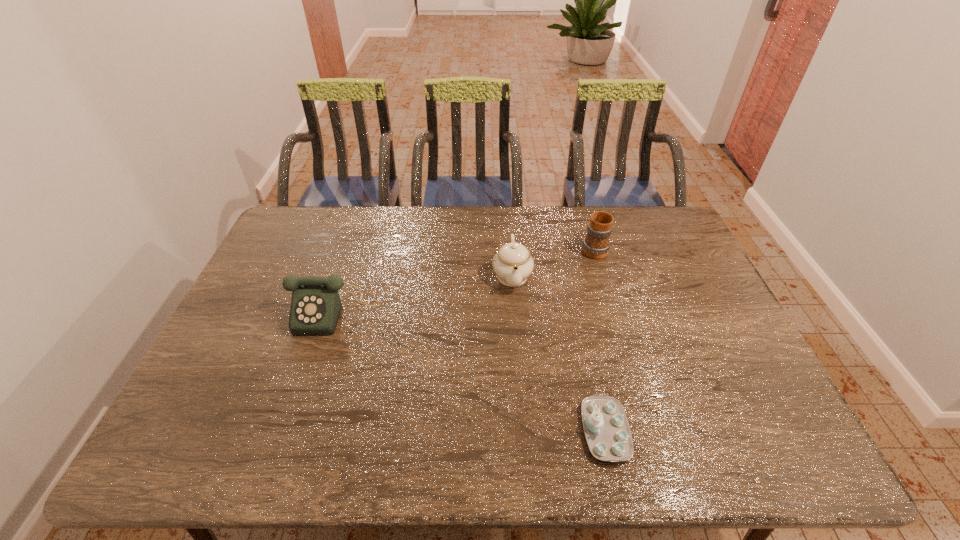
This screenshot has width=960, height=540. I want to click on free spot located 0.190m on the dial of the telephone, so click(x=308, y=396).

Identify the location of vacant region located on the left of the nearest object. (492, 430).

This screenshot has height=540, width=960. Find the location of `object that is positioned at the far edge`. object that is positioned at the far edge is located at coordinates (596, 244).

Where is `object at the near edge`? This screenshot has width=960, height=540. object at the near edge is located at coordinates (606, 427).

In order to click on vacant position at the far edge of the desktop in this screenshot , I will do `click(488, 235)`.

In the image, there is a desktop. Where is `free space at the near edge`? The height and width of the screenshot is (540, 960). free space at the near edge is located at coordinates (613, 462).

In the image, there is a desktop. Find the location of `vacant region at the left edge`. vacant region at the left edge is located at coordinates (244, 399).

At what (x,y) coordinates should I click in order to perform the action: click on free spot at the right edge of the desktop. Please return your answer as a coordinate pair (x, y). The height and width of the screenshot is (540, 960). Looking at the image, I should click on (714, 336).

This screenshot has height=540, width=960. What are the coordinates of `free space at the far left corner of the desktop` in the screenshot? It's located at (317, 246).

This screenshot has height=540, width=960. Identify the location of free location at the far right corner. (662, 233).